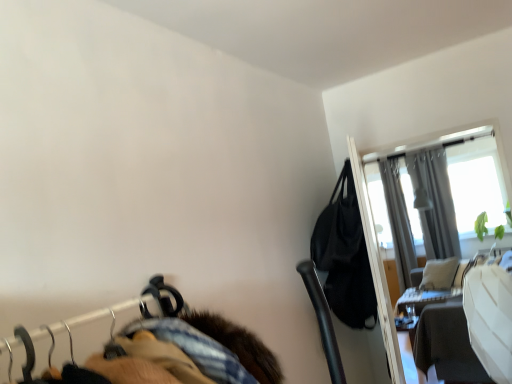
Question: Is black leather bag at upper right positioned behind gray fabric curtain at upper right, the 1th curtain positioned from the left?

Choices:
 (A) no
 (B) yes

Answer: (A)

Question: Is black leather bag at upper right smaller than gray fabric curtain at upper right, the 1th curtain positioned from the left?

Choices:
 (A) no
 (B) yes

Answer: (B)

Question: Does black leather bag at upper right turn towards gray fabric curtain at upper right, acting as the 2th curtain starting from the right?

Choices:
 (A) yes
 (B) no

Answer: (B)

Question: Is black leather bag at upper right bigger than gray fabric curtain at upper right, the 1th curtain positioned from the left?

Choices:
 (A) no
 (B) yes

Answer: (A)

Question: From the image's perspective, is black leather bag at upper right over gray fabric curtain at upper right, the 1th curtain positioned from the left?

Choices:
 (A) no
 (B) yes

Answer: (B)

Question: Does point (365, 238) appear closer or farther from the camera than point (418, 289)?

Choices:
 (A) closer
 (B) farther

Answer: (A)

Question: From the image's perspective, is transparent glass screen door at upper right positioned above or below wooden table at right?

Choices:
 (A) below
 (B) above

Answer: (B)

Question: Is transparent glass screen door at upper right in front of or behind wooden table at right in the image?

Choices:
 (A) behind
 (B) front

Answer: (B)

Question: From a real-world perspective, relative to wooden table at right, is transparent glass screen door at upper right vertically above or below?

Choices:
 (A) below
 (B) above

Answer: (B)

Question: Is wooden table at right taller or shorter than black leather bag at upper right?

Choices:
 (A) tall
 (B) short

Answer: (B)

Question: Considering their positions, is wooden table at right located in front of or behind black leather bag at upper right?

Choices:
 (A) behind
 (B) front

Answer: (A)

Question: Based on their positions, is wooden table at right located to the left or right of black leather bag at upper right?

Choices:
 (A) left
 (B) right

Answer: (B)

Question: From the image's perspective, is wooden table at right above or below black leather bag at upper right?

Choices:
 (A) below
 (B) above

Answer: (A)

Question: Is black leather bag at upper right spatially inside wooden table at right, or outside of it?

Choices:
 (A) outside
 (B) inside

Answer: (A)

Question: From a real-world perspective, is black leather bag at upper right physically located above or below wooden table at right?

Choices:
 (A) above
 (B) below

Answer: (A)